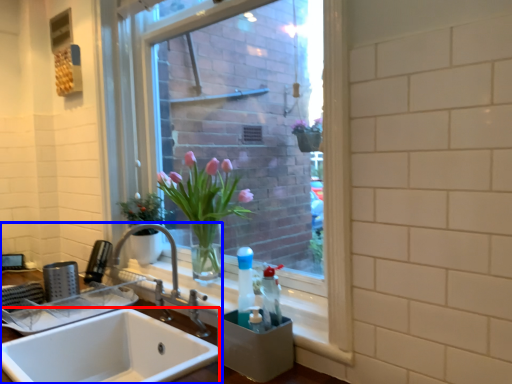
Question: Which object appears closest to the camera in this image, sink (highlighted by a red box) or sink (highlighted by a blue box)?

Choices:
 (A) sink
 (B) sink

Answer: (B)